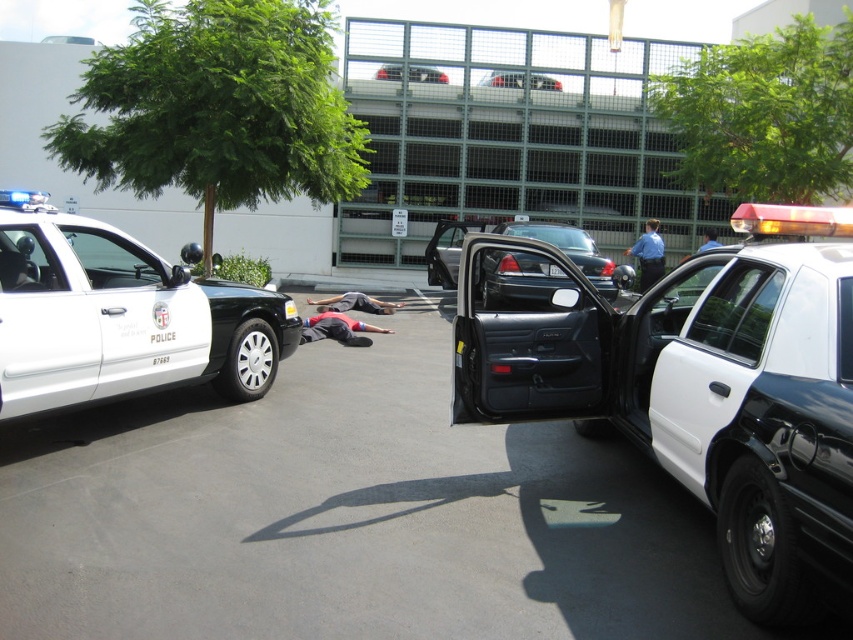
Does shiny black sedan at center have a greater width compared to gray fabric shirt at center?

Correct, the width of shiny black sedan at center exceeds that of gray fabric shirt at center.

Based on the photo, which is more to the right, shiny black sedan at center or gray fabric shirt at center?

shiny black sedan at center is more to the right.

Identify the location of shiny black sedan at center. The height and width of the screenshot is (640, 853). (515, 276).

Does point (798, 552) come farther from viewer compared to point (660, 241)?

No.

Does white glossy police car at center have a greater width compared to blue uniform at center?

Yes.

Image resolution: width=853 pixels, height=640 pixels. What do you see at coordinates (694, 385) in the screenshot?
I see `white glossy police car at center` at bounding box center [694, 385].

Identify the location of white glossy police car at center. (694, 385).

Who is more forward, (846, 230) or (552, 81)?

Point (846, 230) is more forward.

Is white glossy police car at center below metallic silver sedan at center?

Yes.

At what (x,y) coordinates should I click in order to perform the action: click on white glossy police car at center. Please return your answer as a coordinate pair (x, y). The image size is (853, 640). Looking at the image, I should click on (694, 385).

Image resolution: width=853 pixels, height=640 pixels. I want to click on white glossy police car at center, so click(x=694, y=385).